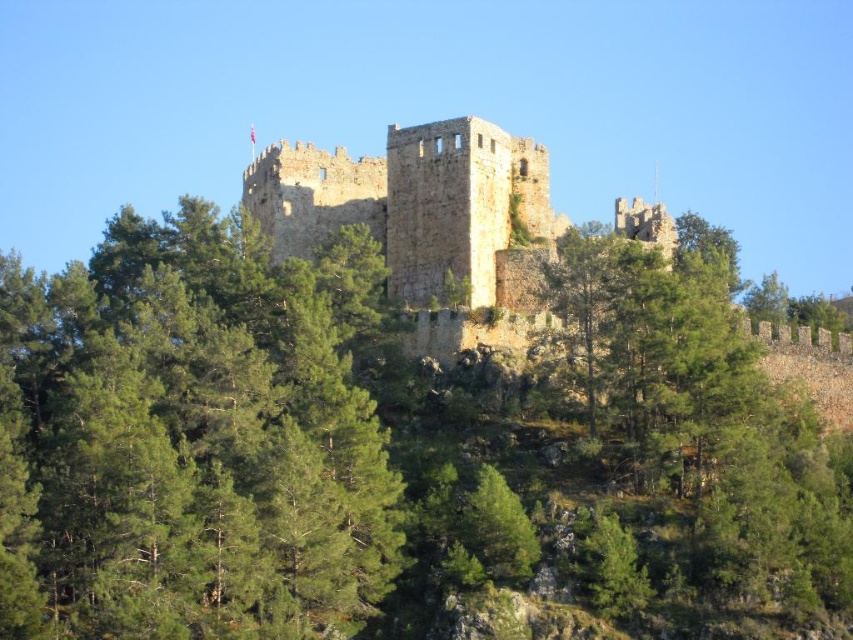
Question: Is green leafy tree at center thinner than brown stone castle at center?

Choices:
 (A) no
 (B) yes

Answer: (B)

Question: Is green leafy tree at center above brown stone castle at center?

Choices:
 (A) no
 (B) yes

Answer: (A)

Question: Is green leafy tree at center bigger than brown stone castle at center?

Choices:
 (A) yes
 (B) no

Answer: (B)

Question: Which point is closer to the camera?

Choices:
 (A) (244, 170)
 (B) (138, 529)

Answer: (B)

Question: Which point is closer to the camera taking this photo?

Choices:
 (A) (310, 241)
 (B) (105, 538)

Answer: (B)

Question: Among these objects, which one is nearest to the camera?

Choices:
 (A) brown stone castle at center
 (B) green leafy tree at center

Answer: (B)